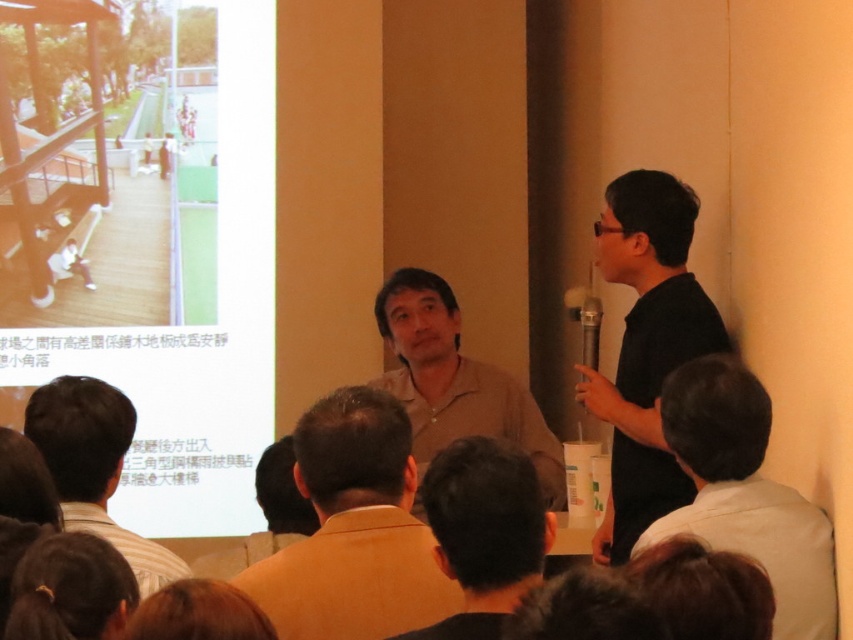
Is matte white screen at upper left bigger than brown shirt at lower center?

Indeed, matte white screen at upper left has a larger size compared to brown shirt at lower center.

Is matte white screen at upper left positioned at the back of brown shirt at lower center?

That is True.

This screenshot has height=640, width=853. What do you see at coordinates (196, 326) in the screenshot? I see `matte white screen at upper left` at bounding box center [196, 326].

What are the coordinates of `matte white screen at upper left` in the screenshot? It's located at (196, 326).

Is matte white screen at upper left wider than light brown shirt at center?

Indeed, matte white screen at upper left has a greater width compared to light brown shirt at center.

Which of these two, matte white screen at upper left or light brown shirt at center, stands taller?

matte white screen at upper left

Is point (193, 404) behind point (257, 573)?

Yes, it is.

Where is `matte white screen at upper left`? Image resolution: width=853 pixels, height=640 pixels. matte white screen at upper left is located at coordinates (196, 326).

Is point (664, 525) less distant than point (463, 396)?

That is True.

Is point (744, 538) behind point (415, 284)?

No.

In the scene shown: Who is more forward, (676,426) or (491,428)?

Point (676,426)

Locate an element on the screen. The height and width of the screenshot is (640, 853). white shirt at right is located at coordinates (746, 492).